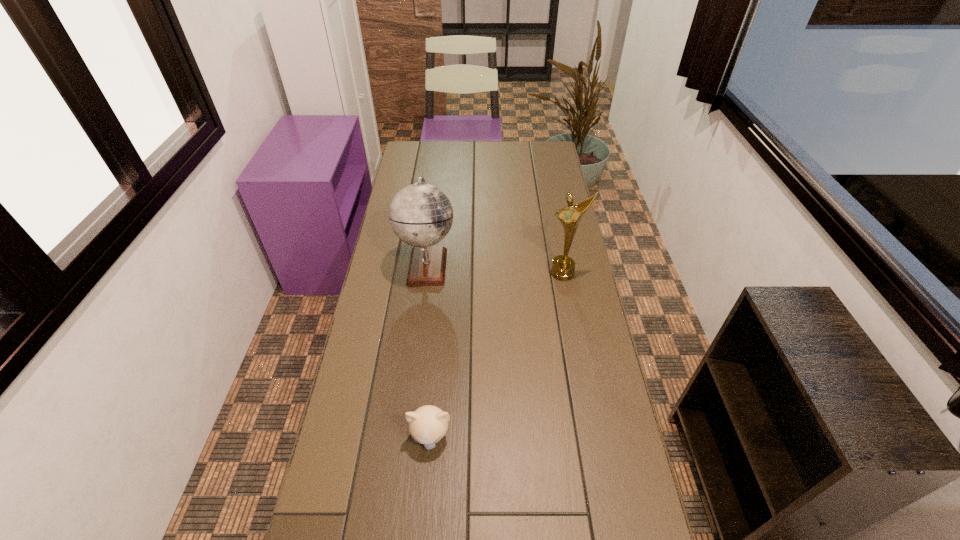
The height and width of the screenshot is (540, 960). I want to click on globe, so click(x=421, y=215).

Locate an element on the screen. The width and height of the screenshot is (960, 540). award is located at coordinates (563, 266).

The height and width of the screenshot is (540, 960). I want to click on kitten, so click(x=428, y=424).

Where is `the shortest object`? The width and height of the screenshot is (960, 540). the shortest object is located at coordinates (428, 424).

Identify the location of vacant space located 0.190m at the equator of the globe. (510, 265).

The width and height of the screenshot is (960, 540). I want to click on free space located 0.250m on the front-facing side of the rightmost object, so point(576,340).

At what (x,y) coordinates should I click in order to perform the action: click on vacant space located on the face of the shortest object. Please return your answer as a coordinate pair (x, y). Image resolution: width=960 pixels, height=540 pixels. Looking at the image, I should click on (422, 530).

You are a GUI agent. You are given a task and a screenshot of the screen. Output one action in this format:
    pyautogui.click(x=<x>, y=<y>)
    Task: Click on the object at the left edge
    The image size is (960, 540).
    Given the screenshot: What is the action you would take?
    pyautogui.click(x=421, y=215)

Identify the location of object present at the right edge. (563, 266).

At what (x,y) coordinates should I click in order to perform the action: click on vacant space at the far edge. Please return your answer as a coordinate pair (x, y). The image size is (960, 540). Looking at the image, I should click on (482, 159).